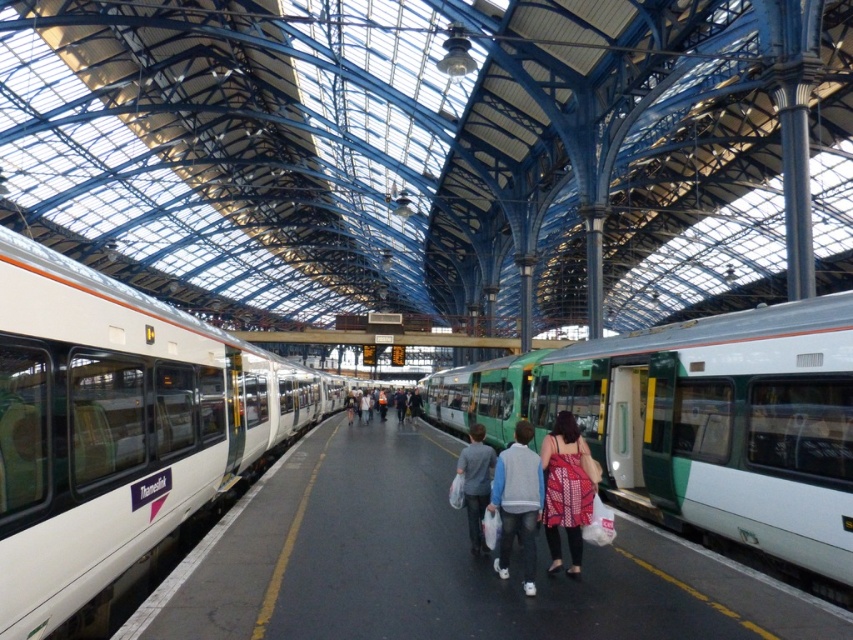
You are a passenger waiting on the platform and see the green matte train at center and the matte gray jacket at center. Which object is taller?

The green matte train at center is taller than the matte gray jacket at center.

You are a maintenance worker needing to reach the white glossy train at left from your current position near the matte gray jacket at center. Can you walk directly to it without needing to go around any obstacles?

The distance between the white glossy train at left and the matte gray jacket at center is 15.07 meters. Since there are no obstacles mentioned in the scene description, you can walk directly to the train.